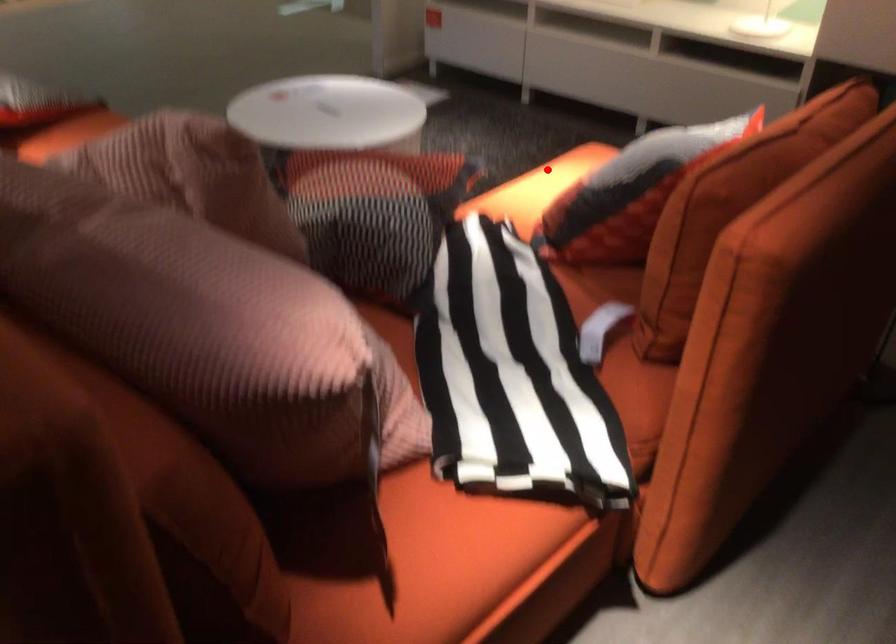
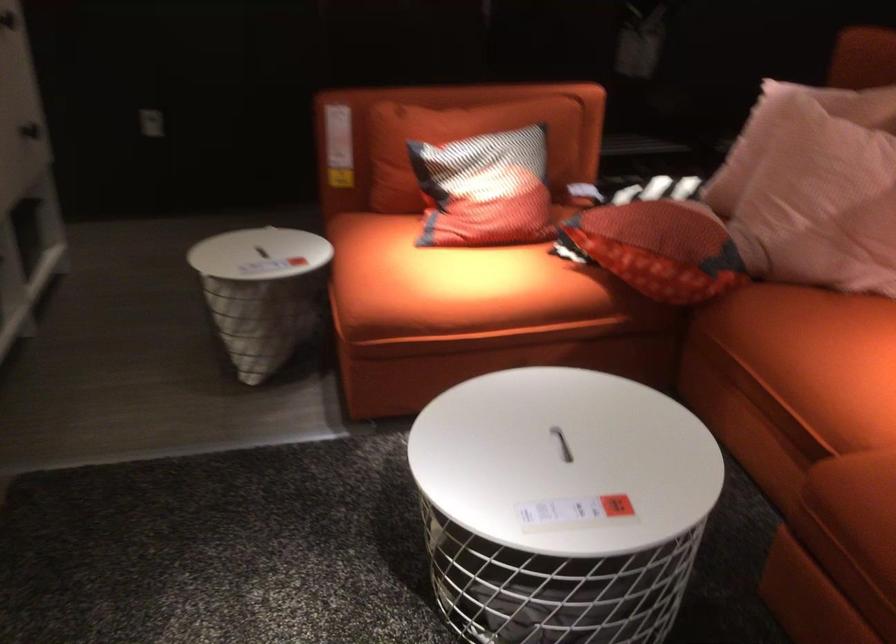
In the second image, find the point that corresponds to the highlighted location in the first image.

(449, 281)